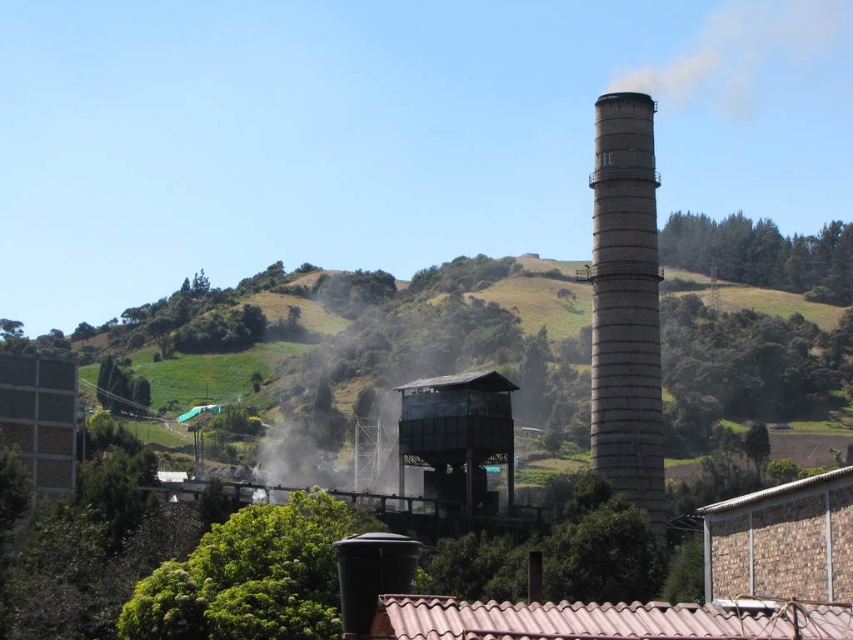
Is gray concrete chimney at center-right taller than matte black tower at center?

Indeed, gray concrete chimney at center-right has a greater height compared to matte black tower at center.

Does gray concrete chimney at center-right appear on the right side of matte black tower at center?

Yes, gray concrete chimney at center-right is to the right of matte black tower at center.

Which is in front, point (633, 330) or point (428, 410)?

Point (633, 330) is in front.

Identify the location of gray concrete chimney at center-right. (625, 305).

Which is more to the right, green grassy hillside at center or gray concrete chimney at center-right?

gray concrete chimney at center-right

From the picture: Between green grassy hillside at center and gray concrete chimney at center-right, which one is positioned lower?

gray concrete chimney at center-right is below.

At what (x,y) coordinates should I click in order to perform the action: click on green grassy hillside at center. Please return your answer as a coordinate pair (x, y). This screenshot has height=640, width=853. Looking at the image, I should click on (379, 333).

What are the coordinates of `green grassy hillside at center` in the screenshot? It's located at (379, 333).

This screenshot has width=853, height=640. Describe the element at coordinates (379, 333) in the screenshot. I see `green grassy hillside at center` at that location.

Which is behind, point (701, 304) or point (459, 481)?

Point (701, 304)

Where is `green grassy hillside at center`? This screenshot has height=640, width=853. green grassy hillside at center is located at coordinates (379, 333).